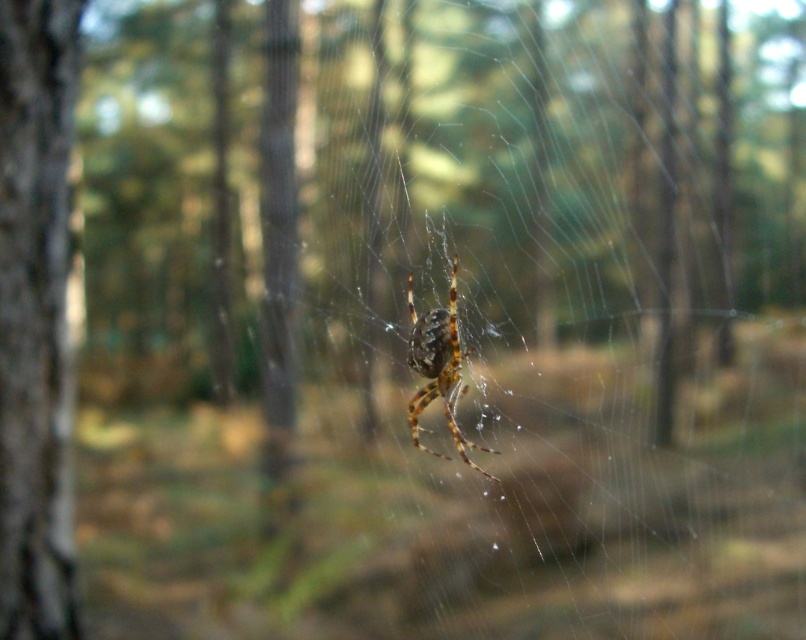
You are a photographer focusing on the brown rough bark at left and the brown fuzzy spider at center. Which object is nearer to your camera lens?

The brown rough bark at left is closer to the viewer than the brown fuzzy spider at center, so it is nearer to the camera lens.

You are a photographer trying to capture the brown fuzzy spider at center and the brown rough bark at left in the same frame. Based on their positions, which object is higher in the image?

The brown rough bark at left is above the brown fuzzy spider at center, so it is higher in the image.

You are a photographer aiming to capture the brown fuzzy spider at center and the brown rough bark at left in your shot. If you want to focus on the spider first, which object should you adjust your camera focus towards, and why?

You should adjust your camera focus towards the brown fuzzy spider at center because it is positioned closer to the viewer than the brown rough bark at left, which is further away. Since the spider is the main subject, focusing on it ensures it remains sharp while the bark in the background can be slightly blurred for emphasis.